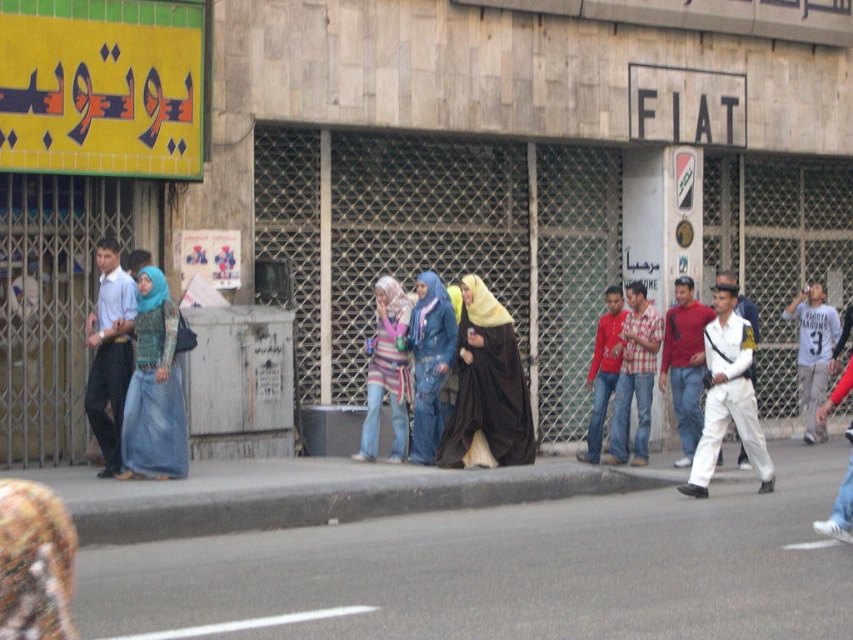
Can you confirm if brown matte hijab at center is thinner than red matte shirt at center?

In fact, brown matte hijab at center might be wider than red matte shirt at center.

What do you see at coordinates (486, 388) in the screenshot? The height and width of the screenshot is (640, 853). I see `brown matte hijab at center` at bounding box center [486, 388].

Which is behind, point (440, 436) or point (596, 400)?

The point (596, 400) is more distant.

Locate an element on the screen. The width and height of the screenshot is (853, 640). brown matte hijab at center is located at coordinates (486, 388).

How much distance is there between matte blue shirt at left and denim fabric hijab at center?

They are 3.08 meters apart.

Does matte blue shirt at left appear over denim fabric hijab at center?

Yes.

Is point (109, 253) positioned before point (439, 428)?

That is True.

The height and width of the screenshot is (640, 853). Find the location of `matte blue shirt at left`. matte blue shirt at left is located at coordinates (109, 353).

Is denim dress at left above plaid cotton shirt at center?

Correct, denim dress at left is located above plaid cotton shirt at center.

Who is more forward, (x=155, y=276) or (x=624, y=454)?

Positioned in front is point (x=155, y=276).

This screenshot has height=640, width=853. In order to click on denim dress at left in this screenshot , I will do `click(154, 388)`.